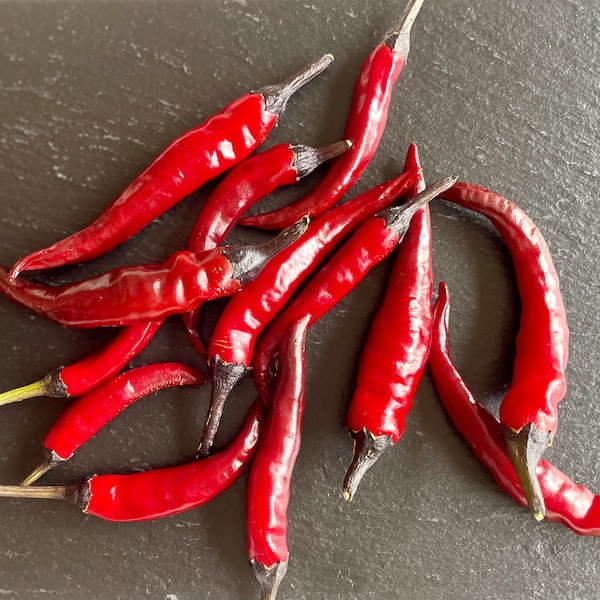
Where is `table`? This screenshot has width=600, height=600. table is located at coordinates (462, 562).